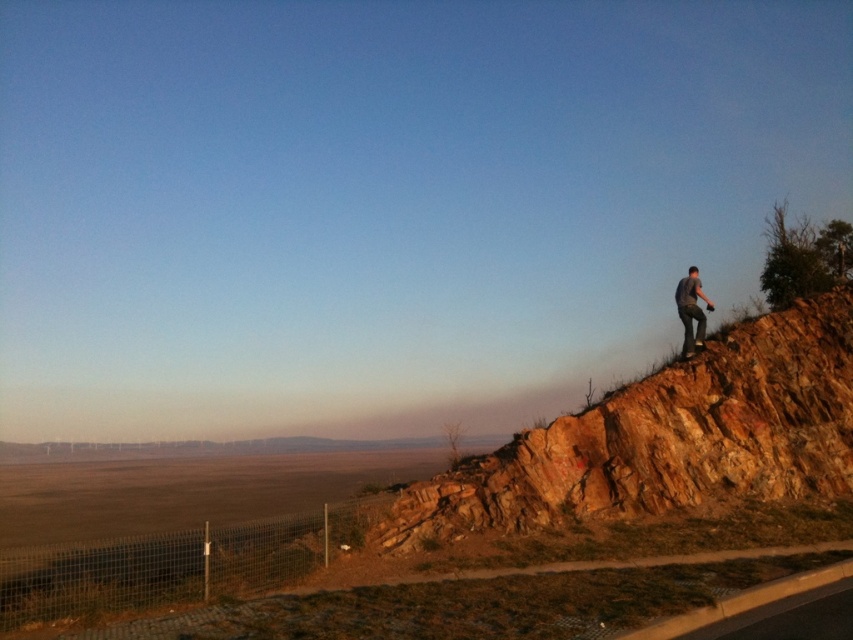
Measure the distance between rustic stone hillside at upper right and dark gray shirt at upper right.

A distance of 3.20 meters exists between rustic stone hillside at upper right and dark gray shirt at upper right.

Is rustic stone hillside at upper right above dark gray shirt at upper right?

Actually, rustic stone hillside at upper right is below dark gray shirt at upper right.

Which is behind, point (695, 374) or point (697, 273)?

Point (697, 273)

Identify the location of rustic stone hillside at upper right. (666, 438).